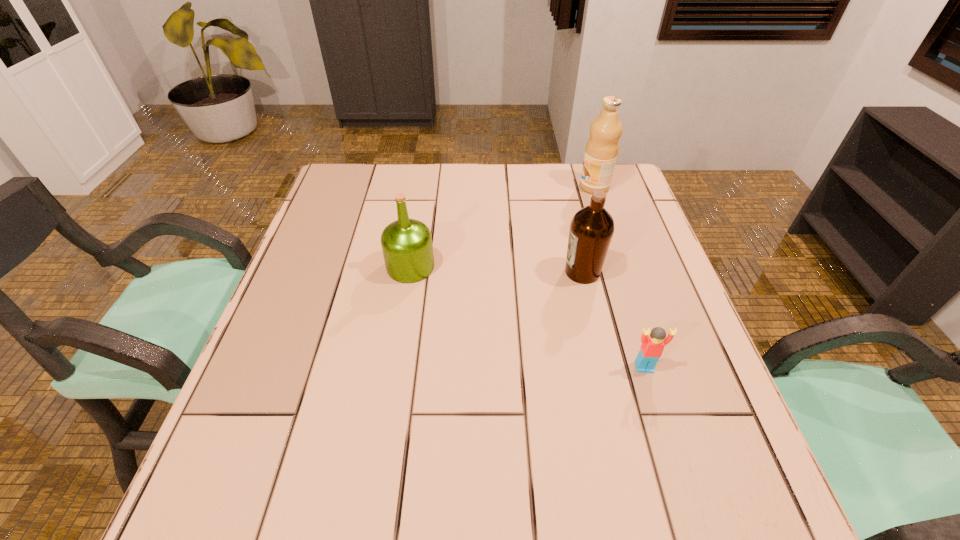
This screenshot has height=540, width=960. Identify the location of free region located 0.330m on the label of the third object from right to left. pyautogui.click(x=427, y=272).

Locate an element on the screen. The width and height of the screenshot is (960, 540). free space located 0.060m on the label of the third object from right to left is located at coordinates (538, 272).

The image size is (960, 540). I want to click on free space located on the left of the leftmost object, so click(358, 267).

Where is `vacant space located 0.110m on the face of the Lego`? vacant space located 0.110m on the face of the Lego is located at coordinates (662, 425).

Locate an element on the screen. The height and width of the screenshot is (540, 960). object situated at the far edge is located at coordinates (602, 148).

Locate an element on the screen. Lego located in the right edge section of the desktop is located at coordinates (652, 346).

The image size is (960, 540). Identify the location of object positioned at the far right corner. (602, 148).

This screenshot has width=960, height=540. What are the coordinates of `vacant region at the far edge of the desktop` in the screenshot? It's located at (538, 185).

The image size is (960, 540). What are the coordinates of `vacant space at the near edge of the desktop` in the screenshot? It's located at (432, 495).

In the image, there is a desktop. Where is `vacant space at the left edge`? vacant space at the left edge is located at coordinates (300, 311).